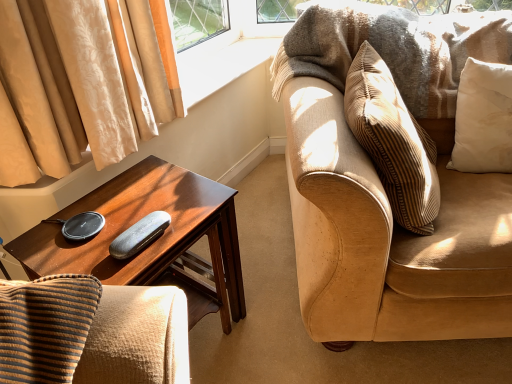
Locate an element on the screen. The height and width of the screenshot is (384, 512). black textured case at center is located at coordinates (139, 235).

The height and width of the screenshot is (384, 512). What are the coordinates of `white cotton pillow at upper right` in the screenshot? It's located at (483, 119).

Which is in front, point (59, 257) or point (150, 226)?

Positioned in front is point (59, 257).

From a real-world perspective, relative to black textured case at center, is shiny brown wood desk at left vertically above or below?

From a real-world perspective, shiny brown wood desk at left is physically below black textured case at center.

From the image's perspective, who appears lower, shiny brown wood desk at left or black textured case at center?

shiny brown wood desk at left appears lower in the image.

Considering the relative positions of white cotton pillow at upper right and black textured case at center in the image provided, is white cotton pillow at upper right to the right of black textured case at center from the viewer's perspective?

Yes.

Can you confirm if white cotton pillow at upper right is shorter than black textured case at center?

In fact, white cotton pillow at upper right may be taller than black textured case at center.

Consider the image. Could you tell me if white cotton pillow at upper right is turned towards black textured case at center?

No, white cotton pillow at upper right is not facing towards black textured case at center.

In the image, is white cotton pillow at upper right positioned in front of or behind black textured case at center?

In the image, white cotton pillow at upper right appears behind black textured case at center.

Does suede couch at right have a greater height compared to white cotton pillow at upper right?

Indeed, suede couch at right has a greater height compared to white cotton pillow at upper right.

Is point (493, 217) closer or farther from the camera than point (503, 137)?

Point (493, 217).

From a real-world perspective, which is physically below, suede couch at right or white cotton pillow at upper right?

suede couch at right is physically lower.

In the image, is shiny brown wood desk at left positioned in front of or behind white cotton pillow at upper right?

shiny brown wood desk at left is positioned closer to the viewer than white cotton pillow at upper right.

Is shiny brown wood desk at left facing towards white cotton pillow at upper right?

No, shiny brown wood desk at left is not oriented towards white cotton pillow at upper right.

Based on the photo, considering the sizes of objects shiny brown wood desk at left and white cotton pillow at upper right in the image provided, who is wider, shiny brown wood desk at left or white cotton pillow at upper right?

Wider between the two is shiny brown wood desk at left.

Is shiny brown wood desk at left placed right next to white cotton pillow at upper right?

No, shiny brown wood desk at left is not beside white cotton pillow at upper right.

Does suede couch at right have a larger size compared to shiny brown wood desk at left?

Yes, suede couch at right is bigger than shiny brown wood desk at left.

Is point (305, 50) closer to camera compared to point (124, 179)?

No, (305, 50) is behind (124, 179).

Considering the relative sizes of suede couch at right and shiny brown wood desk at left in the image provided, is suede couch at right taller than shiny brown wood desk at left?

Yes, suede couch at right is taller than shiny brown wood desk at left.

Considering the positions of objects suede couch at right and shiny brown wood desk at left in the image provided, who is more to the left, suede couch at right or shiny brown wood desk at left?

shiny brown wood desk at left.

Based on the photo, is shiny brown wood desk at left not near suede couch at right?

No.

Between shiny brown wood desk at left and suede couch at right, which one has more height?

suede couch at right.

The image size is (512, 384). In order to click on desk on the left of the suede couch at right in this screenshot , I will do `click(153, 242)`.

Which is in front, point (221, 262) or point (398, 254)?

The point (398, 254) is closer to the camera.

Is the depth of black textured case at center greater than that of shiny brown wood desk at left?

That is True.

You are a GUI agent. You are given a task and a screenshot of the screen. Output one action in this format:
    pyautogui.click(x=<x>, y=<y>)
    Task: Click on the remote control that appears on the right of shiny brown wood desk at left
    This screenshot has height=384, width=512.
    Given the screenshot: What is the action you would take?
    pyautogui.click(x=139, y=235)

Between black textured case at center and shiny brown wood desk at left, which one has more height?

With more height is shiny brown wood desk at left.

Is black textured case at center situated inside shiny brown wood desk at left or outside?

black textured case at center fits inside shiny brown wood desk at left.

Locate an element on the screen. desk in front of the black textured case at center is located at coordinates (153, 242).

At what (x,y) coordinates should I click in order to perform the action: click on pillow above the black textured case at center (from the image's perspective). Please return your answer as a coordinate pair (x, y). The width and height of the screenshot is (512, 384). Looking at the image, I should click on (483, 119).

Which object lies nearer to the anchor point shiny brown wood desk at left, black textured case at center or white cotton pillow at upper right?

Among the two, black textured case at center is located nearer to shiny brown wood desk at left.

Looking at the image, which one is located further to white cotton pillow at upper right, black textured case at center or shiny brown wood desk at left?

black textured case at center.

Considering their positions, is white cotton pillow at upper right positioned closer to shiny brown wood desk at left than black textured case at center?

black textured case at center lies closer to shiny brown wood desk at left than the other object.

Looking at the image, which one is located closer to suede couch at right, white cotton pillow at upper right or black textured case at center?

Among the two, white cotton pillow at upper right is located nearer to suede couch at right.

When comparing their distances from suede couch at right, does black textured case at center or shiny brown wood desk at left seem further?

black textured case at center lies further to suede couch at right than the other object.

Which object lies further to the anchor point black textured case at center, suede couch at right or shiny brown wood desk at left?

The object further to black textured case at center is suede couch at right.

Which object lies nearer to the anchor point shiny brown wood desk at left, white cotton pillow at upper right or suede couch at right?

suede couch at right is closer to shiny brown wood desk at left.

From the image, which object appears to be farther from shiny brown wood desk at left, suede couch at right or white cotton pillow at upper right?

white cotton pillow at upper right.

I want to click on studio couch between shiny brown wood desk at left and white cotton pillow at upper right in the horizontal direction, so click(384, 185).

This screenshot has width=512, height=384. Identify the location of remote control between shiny brown wood desk at left and white cotton pillow at upper right from left to right. (139, 235).

Image resolution: width=512 pixels, height=384 pixels. I want to click on studio couch between black textured case at center and white cotton pillow at upper right in the horizontal direction, so pos(384,185).

Identify the location of remote control between shiny brown wood desk at left and suede couch at right in the horizontal direction. This screenshot has height=384, width=512. (139, 235).